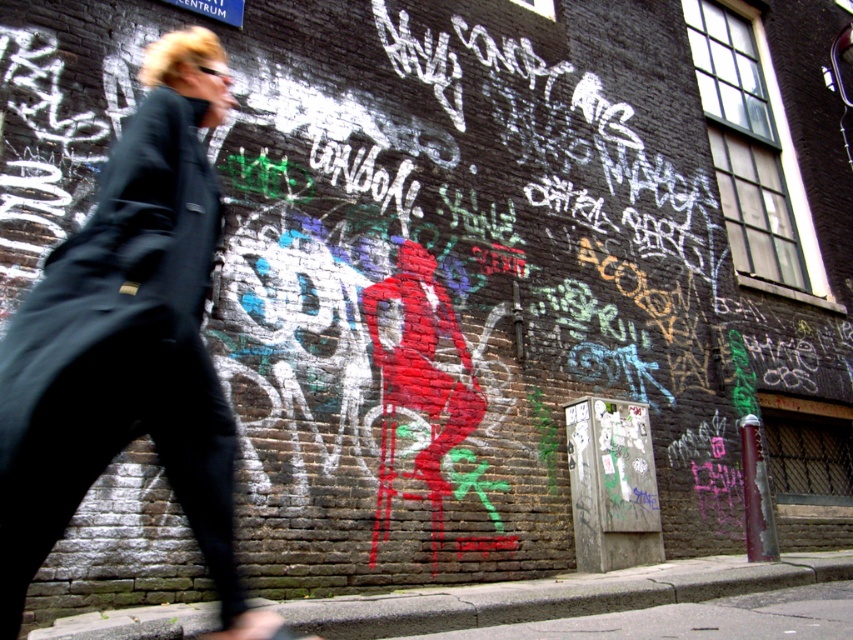
Question: Among these points, which one is nearest to the camera?

Choices:
 (A) (132, 141)
 (B) (335, 618)

Answer: (A)

Question: Can you confirm if matte black coat at left is positioned below concrete sidewalk at lower center?

Choices:
 (A) yes
 (B) no

Answer: (B)

Question: Which point is farther to the camera?

Choices:
 (A) concrete sidewalk at lower center
 (B) matte black coat at left

Answer: (A)

Question: Is matte black coat at left smaller than concrete sidewalk at lower center?

Choices:
 (A) yes
 (B) no

Answer: (A)

Question: Among these objects, which one is farthest from the camera?

Choices:
 (A) matte black coat at left
 (B) concrete sidewalk at lower center

Answer: (B)

Question: Is matte black coat at left to the left of concrete sidewalk at lower center from the viewer's perspective?

Choices:
 (A) no
 (B) yes

Answer: (B)